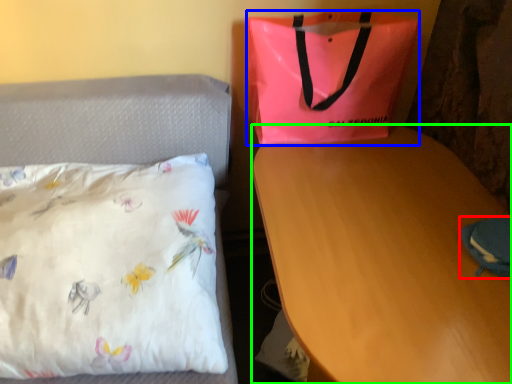
Question: Based on their relative distances, which object is farther from pouch (highlighted by a red box)? Choose from handbag (highlighted by a blue box) and desk (highlighted by a green box).

Choices:
 (A) handbag
 (B) desk

Answer: (A)